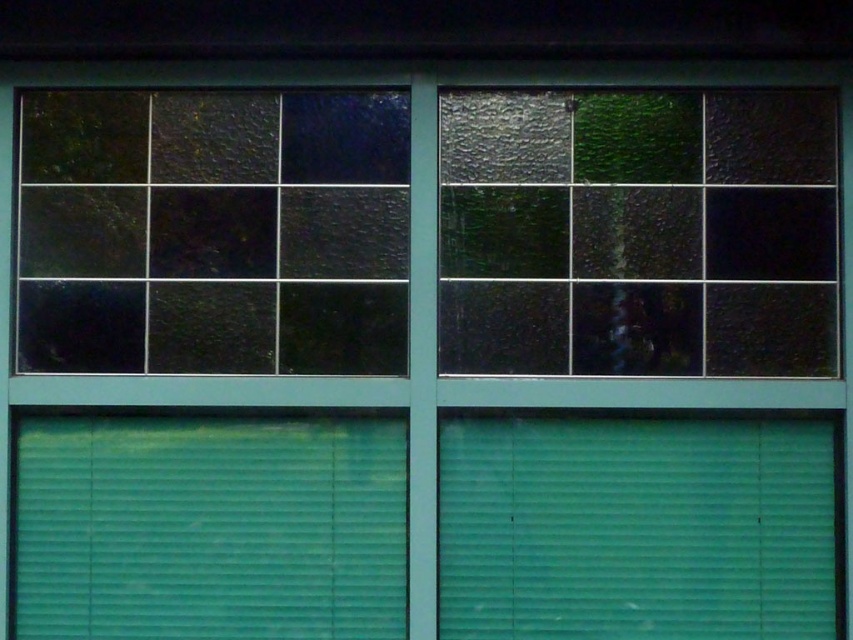
Question: Estimate the real-world distances between objects in this image. Which object is closer to the textured glass window at upper left?

Choices:
 (A) teal matte shutter at bottom right
 (B) green matte blinds at bottom

Answer: (B)

Question: Among these points, which one is farthest from the camera?

Choices:
 (A) (635, 456)
 (B) (54, 150)
 (C) (131, 305)
 (D) (28, 577)

Answer: (B)

Question: Which is nearer to the green matte blinds at bottom?

Choices:
 (A) green matte shutter at lower left
 (B) teal matte shutter at bottom right
 (C) textured glass window at upper left
 (D) textured glass window at center

Answer: (B)

Question: Can you confirm if textured glass window at center is thinner than textured glass window at upper left?

Choices:
 (A) no
 (B) yes

Answer: (A)

Question: Is the position of textured glass window at center less distant than that of green matte blinds at bottom?

Choices:
 (A) yes
 (B) no

Answer: (B)

Question: Does textured glass window at center have a lesser width compared to green matte shutter at lower left?

Choices:
 (A) no
 (B) yes

Answer: (A)